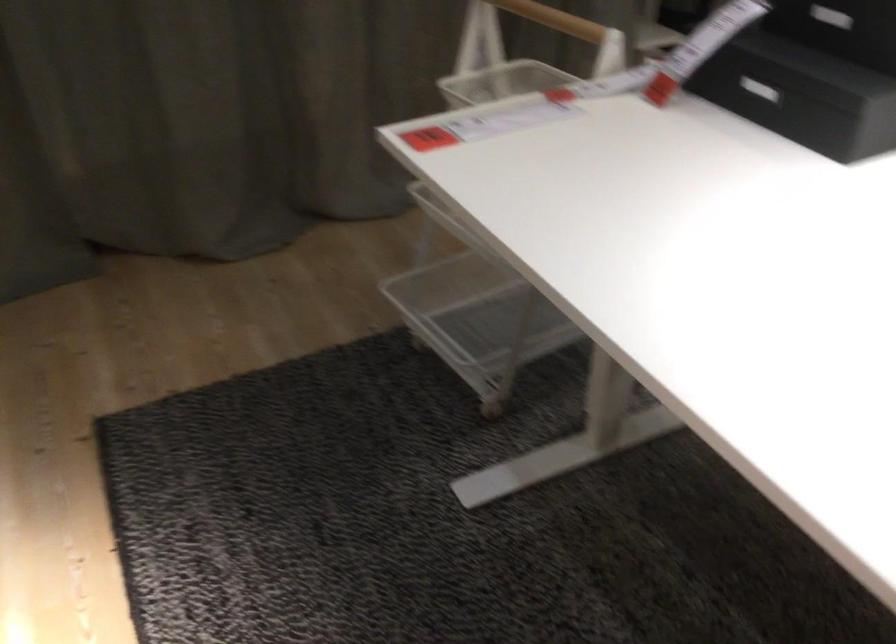
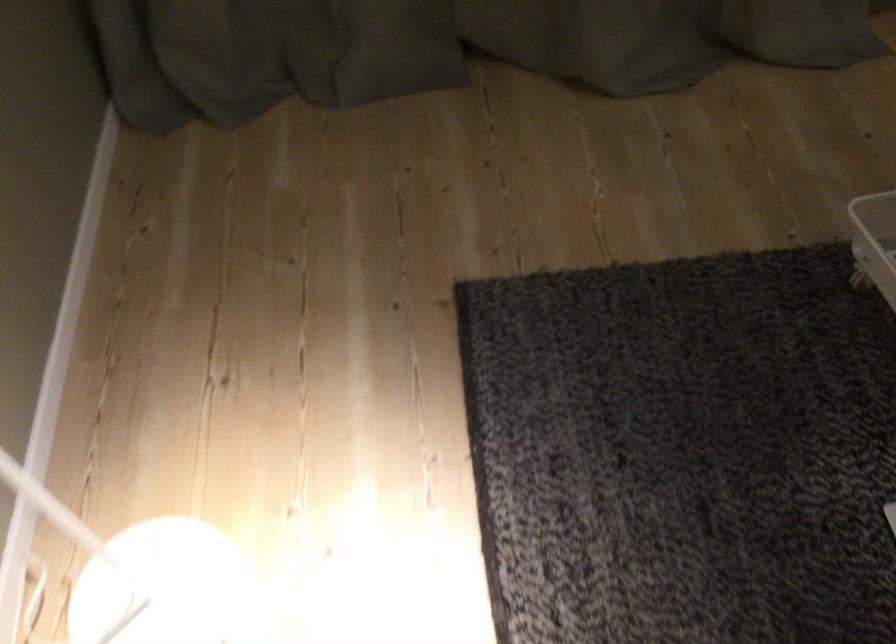
First-person continuous shooting, in which direction is the camera rotating?

The rotation direction of the camera is left-down.